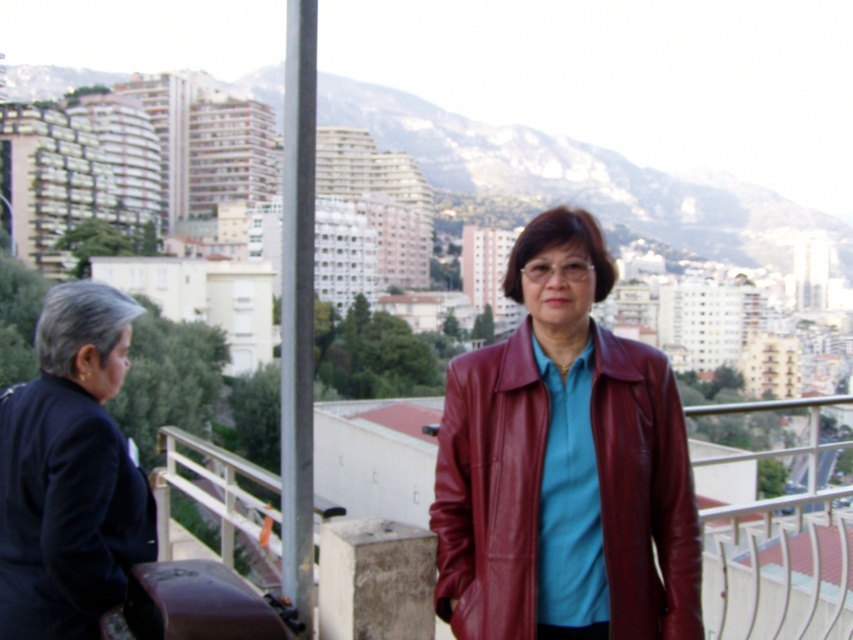
Who is shorter, shiny maroon leather jacket at center or dark blue leather jacket at left?

dark blue leather jacket at left

Can you confirm if shiny maroon leather jacket at center is positioned below dark blue leather jacket at left?

Correct, shiny maroon leather jacket at center is located below dark blue leather jacket at left.

Is point (631, 500) behind point (39, 403)?

Yes, it is behind point (39, 403).

In order to click on shiny maroon leather jacket at center in this screenshot , I will do `click(490, 490)`.